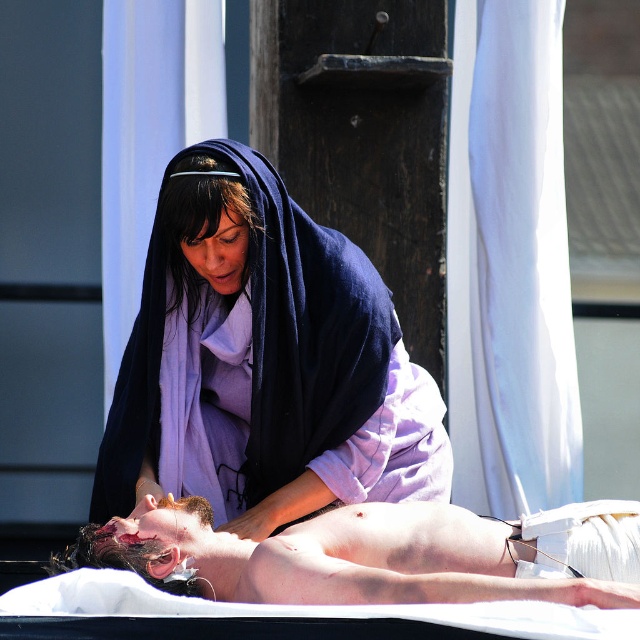
Does point (180, 280) come closer to viewer compared to point (504, 576)?

No, (180, 280) is behind (504, 576).

This screenshot has height=640, width=640. What do you see at coordinates (262, 362) in the screenshot? I see `matte purple robe at center` at bounding box center [262, 362].

Describe the element at coordinates (262, 362) in the screenshot. I see `matte purple robe at center` at that location.

This screenshot has width=640, height=640. I want to click on matte purple robe at center, so click(x=262, y=362).